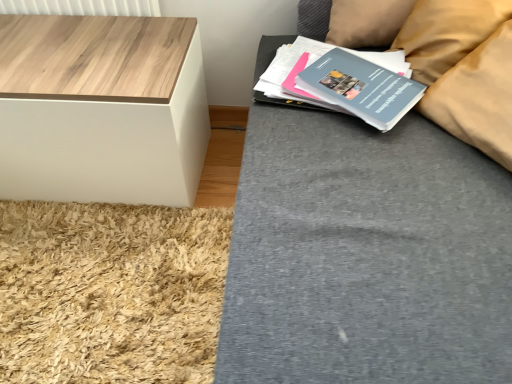
Question: Is matte blue paperback book at upper right, the 1th paperback book viewed from the back, located within beige fabric pillow at upper right?

Choices:
 (A) yes
 (B) no

Answer: (B)

Question: Considering the relative sizes of beige fabric pillow at upper right and matte blue paperback book at upper right, the 2th paperback book in the front-to-back sequence, in the image provided, is beige fabric pillow at upper right thinner than matte blue paperback book at upper right, the 2th paperback book in the front-to-back sequence,?

Choices:
 (A) no
 (B) yes

Answer: (B)

Question: Is beige fabric pillow at upper right outside of matte blue paperback book at upper right, the 1th paperback book viewed from the back?

Choices:
 (A) yes
 (B) no

Answer: (A)

Question: Considering the relative positions of beige fabric pillow at upper right and matte blue paperback book at upper right, the 1th paperback book viewed from the back, in the image provided, is beige fabric pillow at upper right in front of matte blue paperback book at upper right, the 1th paperback book viewed from the back,?

Choices:
 (A) no
 (B) yes

Answer: (A)

Question: Is the position of beige fabric pillow at upper right more distant than that of matte blue paperback book at upper right, the 2th paperback book in the front-to-back sequence?

Choices:
 (A) no
 (B) yes

Answer: (B)

Question: Is matte blue paperback book at upper right, the 2th paperback book in the front-to-back sequence, bigger or smaller than beige fabric pillow at upper right?

Choices:
 (A) big
 (B) small

Answer: (B)

Question: Is matte blue paperback book at upper right, the 2th paperback book in the front-to-back sequence, wider or thinner than beige fabric pillow at upper right?

Choices:
 (A) wide
 (B) thin

Answer: (A)

Question: In terms of height, does matte blue paperback book at upper right, the 1th paperback book viewed from the back, look taller or shorter compared to beige fabric pillow at upper right?

Choices:
 (A) tall
 (B) short

Answer: (B)

Question: Would you say matte blue paperback book at upper right, the 2th paperback book in the front-to-back sequence, is inside or outside beige fabric pillow at upper right?

Choices:
 (A) outside
 (B) inside

Answer: (A)

Question: From the image's perspective, is matte gray paperback book at upper right, the second paperback book positioned from the back, above or below wooden white cube at left?

Choices:
 (A) above
 (B) below

Answer: (A)

Question: From a real-world perspective, is matte gray paperback book at upper right, the second paperback book positioned from the back, above or below wooden white cube at left?

Choices:
 (A) above
 (B) below

Answer: (A)

Question: Is matte gray paperback book at upper right, the first paperback book when ordered from front to back, bigger or smaller than wooden white cube at left?

Choices:
 (A) small
 (B) big

Answer: (A)

Question: Would you say matte gray paperback book at upper right, the second paperback book positioned from the back, is inside or outside wooden white cube at left?

Choices:
 (A) inside
 (B) outside

Answer: (B)

Question: From a real-world perspective, is matte gray paperback book at upper right, the second paperback book positioned from the back, positioned above or below beige fabric pillow at upper right?

Choices:
 (A) below
 (B) above

Answer: (A)

Question: From the image's perspective, is matte gray paperback book at upper right, the first paperback book when ordered from front to back, above or below beige fabric pillow at upper right?

Choices:
 (A) below
 (B) above

Answer: (A)